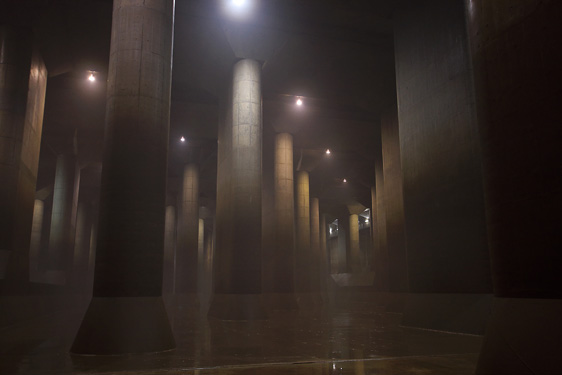
Image resolution: width=562 pixels, height=375 pixels. Identify the location of floor. (271, 323).